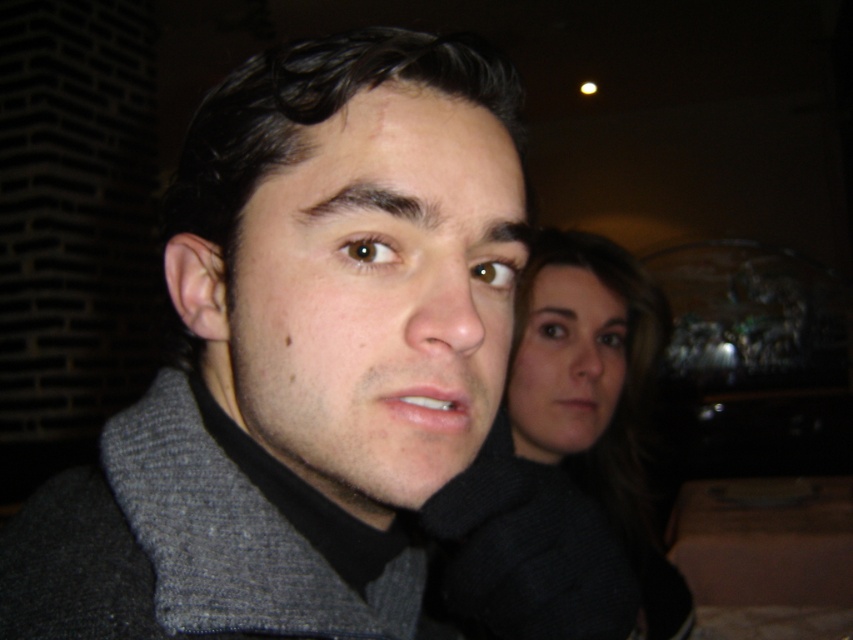
Is gray fleece jacket at center wider than black woolen sweater at center?

Incorrect, gray fleece jacket at center's width does not surpass black woolen sweater at center's.

What do you see at coordinates (300, 355) in the screenshot? The height and width of the screenshot is (640, 853). I see `gray fleece jacket at center` at bounding box center [300, 355].

This screenshot has width=853, height=640. I want to click on gray fleece jacket at center, so click(x=300, y=355).